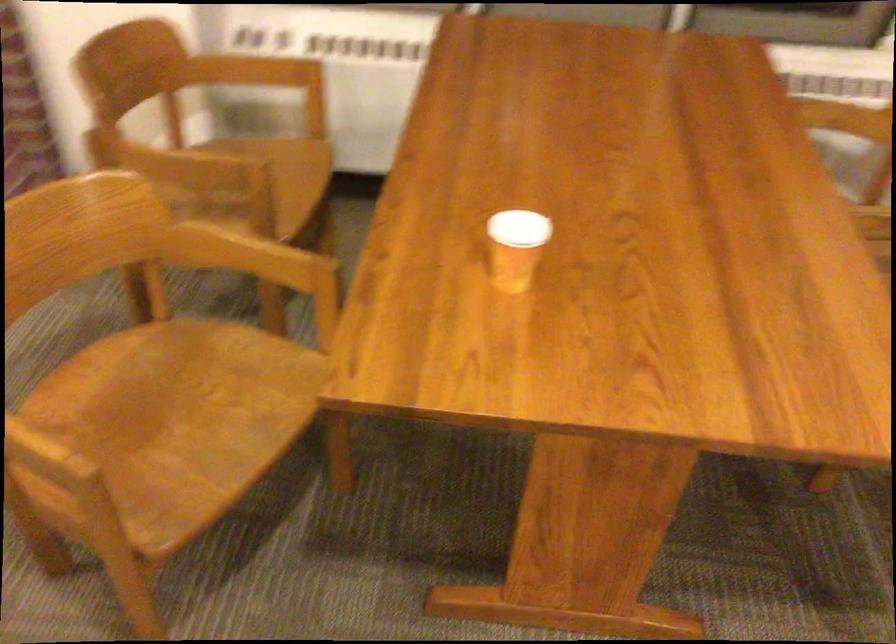
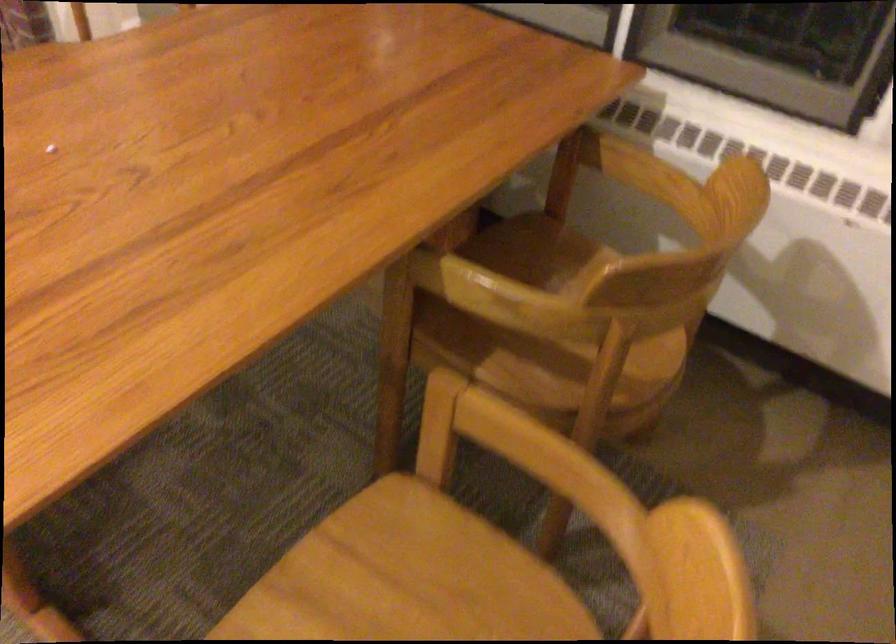
In the second image, find the point that corresponds to pixel 802 109 in the first image.

(621, 167)